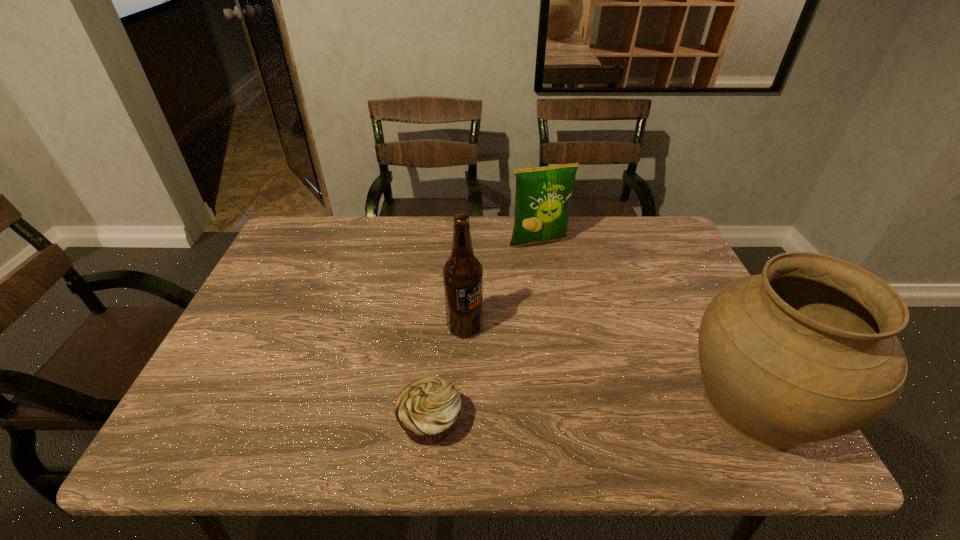
Where is `the shortest object`? This screenshot has width=960, height=540. the shortest object is located at coordinates (427, 409).

Find the location of a particular element. This screenshot has width=960, height=540. urn is located at coordinates (807, 351).

The image size is (960, 540). Identify the location of crisp (potato chip). tap(543, 194).

You are a GUI agent. You are given a task and a screenshot of the screen. Output one action in this format:
    pyautogui.click(x=<x>, y=<y>)
    Task: Click on the third object from left to right
    
    Given the screenshot: What is the action you would take?
    pyautogui.click(x=543, y=194)

Locate an element on the screen. The width and height of the screenshot is (960, 540). the third nearest object is located at coordinates (463, 273).

Locate an element on the screen. The image size is (960, 540). free region located 0.090m on the back of the rightmost object is located at coordinates (709, 319).

Find the location of `free spot located on the front-facing side of the crisp (potato chip)`. free spot located on the front-facing side of the crisp (potato chip) is located at coordinates [567, 286].

Locate an element on the screen. vacant space located 0.290m on the front-facing side of the crisp (potato chip) is located at coordinates (588, 319).

Identify the location of vacant space situated on the front-facing side of the crisp (potato chip). Image resolution: width=960 pixels, height=540 pixels. (570, 291).

Find the location of a particular element. The width and height of the screenshot is (960, 540). vacant region located 0.160m on the label of the third nearest object is located at coordinates (522, 377).